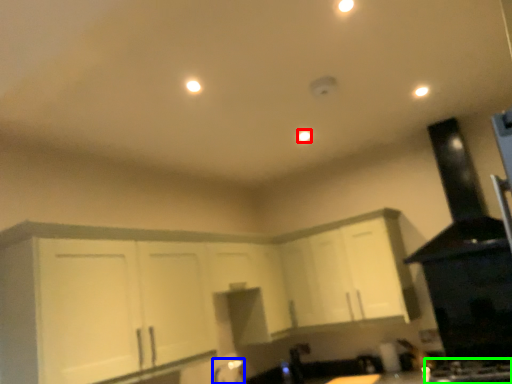
Question: Which object is positioned closest to light (highlighted by a red box)? Select from faucet (highlighted by a blue box) and gas stove (highlighted by a green box).

Choices:
 (A) faucet
 (B) gas stove

Answer: (B)